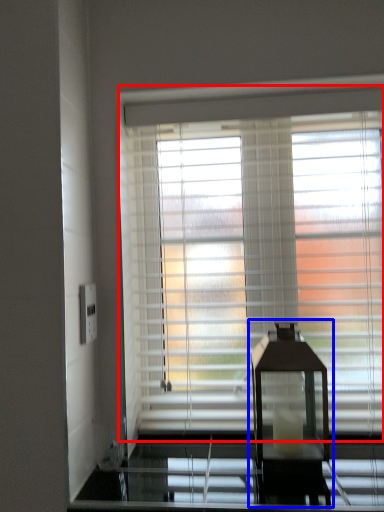
Question: Which object is closer to the camera taking this photo, window blind (highlighted by a red box) or table lamp (highlighted by a blue box)?

Choices:
 (A) window blind
 (B) table lamp

Answer: (B)